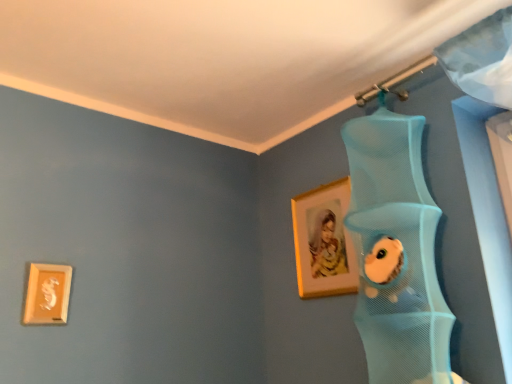
Question: Which direction should I rotate to look at matte gold picture frame at upper center, the 2th picture frame viewed from the left, — up or down?

Choices:
 (A) up
 (B) down

Answer: (B)

Question: Is matte gold picture frame at upper center, positioned as the second picture frame in front-to-back order, aimed at matte gold picture frame at lower left, which is the first picture frame from left to right?

Choices:
 (A) yes
 (B) no

Answer: (A)

Question: Could matte gold picture frame at lower left, which is the first picture frame from left to right, be considered to be inside matte gold picture frame at upper center, the 2th picture frame viewed from the left?

Choices:
 (A) yes
 (B) no

Answer: (B)

Question: From a real-world perspective, is matte gold picture frame at upper center, the 2th picture frame viewed from the left, under matte gold picture frame at lower left, which is counted as the 1th picture frame, starting from the front?

Choices:
 (A) yes
 (B) no

Answer: (B)

Question: Is matte gold picture frame at upper center, positioned as the second picture frame in front-to-back order, not within matte gold picture frame at lower left, arranged as the second picture frame when viewed from the right?

Choices:
 (A) yes
 (B) no

Answer: (A)

Question: Is matte gold picture frame at upper center, the 2th picture frame viewed from the left, closer to the viewer compared to matte gold picture frame at lower left, acting as the second picture frame starting from the back?

Choices:
 (A) yes
 (B) no

Answer: (B)

Question: Can you confirm if matte gold picture frame at upper center, acting as the 1th picture frame starting from the right, is taller than matte gold picture frame at lower left, acting as the second picture frame starting from the back?

Choices:
 (A) yes
 (B) no

Answer: (A)

Question: From a real-world perspective, is matte gold picture frame at lower left, arranged as the second picture frame when viewed from the right, physically above matte gold picture frame at upper center, the first picture frame when ordered from back to front?

Choices:
 (A) no
 (B) yes

Answer: (A)

Question: Can you confirm if matte gold picture frame at lower left, which is the first picture frame from left to right, is smaller than matte gold picture frame at upper center, the 2th picture frame viewed from the left?

Choices:
 (A) no
 (B) yes

Answer: (B)

Question: From the image's perspective, is matte gold picture frame at lower left, which is the first picture frame from left to right, below matte gold picture frame at upper center, the 2th picture frame viewed from the left?

Choices:
 (A) yes
 (B) no

Answer: (A)

Question: Can you confirm if matte gold picture frame at lower left, acting as the second picture frame starting from the back, is positioned to the right of matte gold picture frame at upper center, the 2th picture frame viewed from the left?

Choices:
 (A) yes
 (B) no

Answer: (B)

Question: Is matte gold picture frame at lower left, which is counted as the 1th picture frame, starting from the front, at the left side of matte gold picture frame at upper center, positioned as the second picture frame in front-to-back order?

Choices:
 (A) no
 (B) yes

Answer: (B)

Question: Is matte gold picture frame at lower left, acting as the second picture frame starting from the back, bigger than matte gold picture frame at upper center, the 2th picture frame viewed from the left?

Choices:
 (A) no
 (B) yes

Answer: (A)

Question: From a real-world perspective, is matte gold picture frame at upper center, acting as the 1th picture frame starting from the right, physically located above or below matte gold picture frame at lower left, which is counted as the 1th picture frame, starting from the front?

Choices:
 (A) below
 (B) above

Answer: (B)